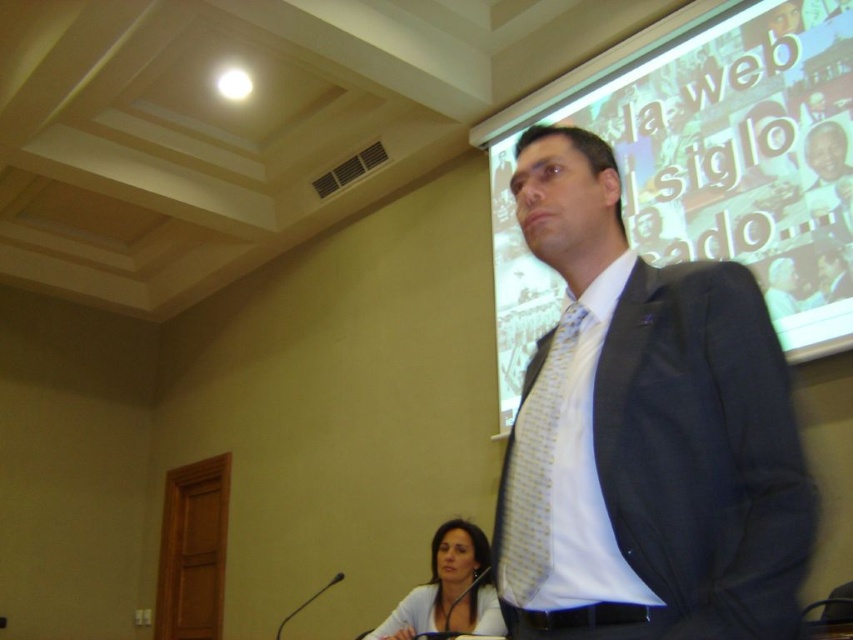
Question: Among these points, which one is farthest from the camera?

Choices:
 (A) (664, 84)
 (B) (485, 556)

Answer: (A)

Question: Is yellow dotted tie at center smaller than smooth white shirt at lower center?

Choices:
 (A) yes
 (B) no

Answer: (A)

Question: Which object is farther from the camera taking this photo?

Choices:
 (A) smooth white shirt at lower center
 (B) yellow dotted tie at center
 (C) matte white projection screen at upper right
 (D) matte black suit at center

Answer: (C)

Question: Among these points, which one is farthest from the camera?

Choices:
 (A) (810, 540)
 (B) (432, 620)
 (C) (759, 161)
 (D) (548, 573)

Answer: (C)

Question: Where is matte black suit at center located in relation to smooth white shirt at lower center in the image?

Choices:
 (A) left
 (B) right

Answer: (B)

Question: Is matte black suit at center behind yellow dotted tie at center?

Choices:
 (A) no
 (B) yes

Answer: (A)